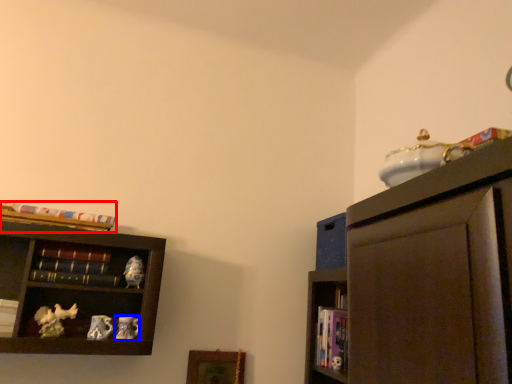
Question: Which object is closer to the camera taking this photo, book (highlighted by a red box) or toy (highlighted by a blue box)?

Choices:
 (A) book
 (B) toy

Answer: (A)